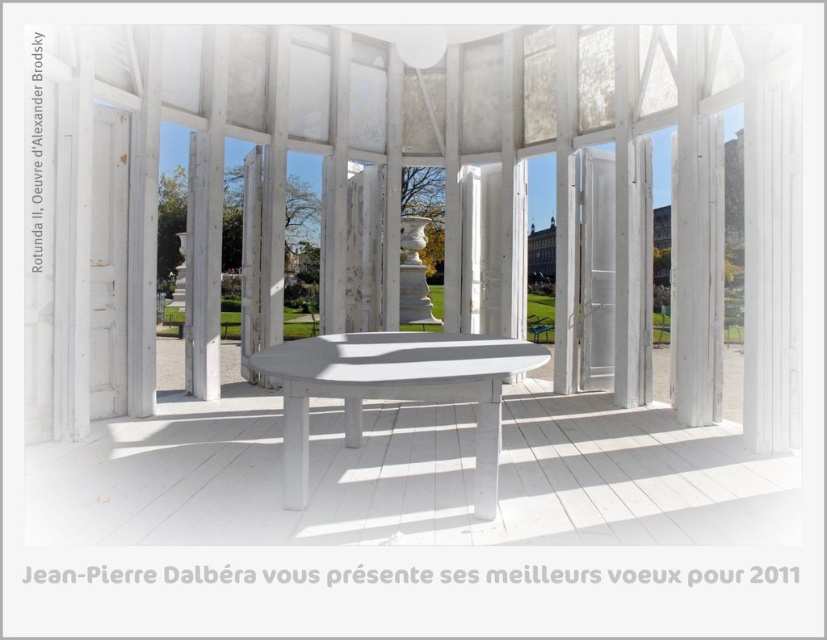
Question: Which object appears closest to the camera in this image?

Choices:
 (A) white painted wood table at center
 (B) white wood window at center

Answer: (A)

Question: Among these objects, which one is nearest to the camera?

Choices:
 (A) white wood window at center
 (B) white painted wood table at center

Answer: (B)

Question: Is white wood window at center further to the viewer compared to white painted wood table at center?

Choices:
 (A) no
 (B) yes

Answer: (B)

Question: Observing the image, what is the correct spatial positioning of white wood window at center in reference to white painted wood table at center?

Choices:
 (A) right
 (B) left

Answer: (A)

Question: From the image, what is the correct spatial relationship of white wood window at center in relation to white painted wood table at center?

Choices:
 (A) right
 (B) left

Answer: (A)